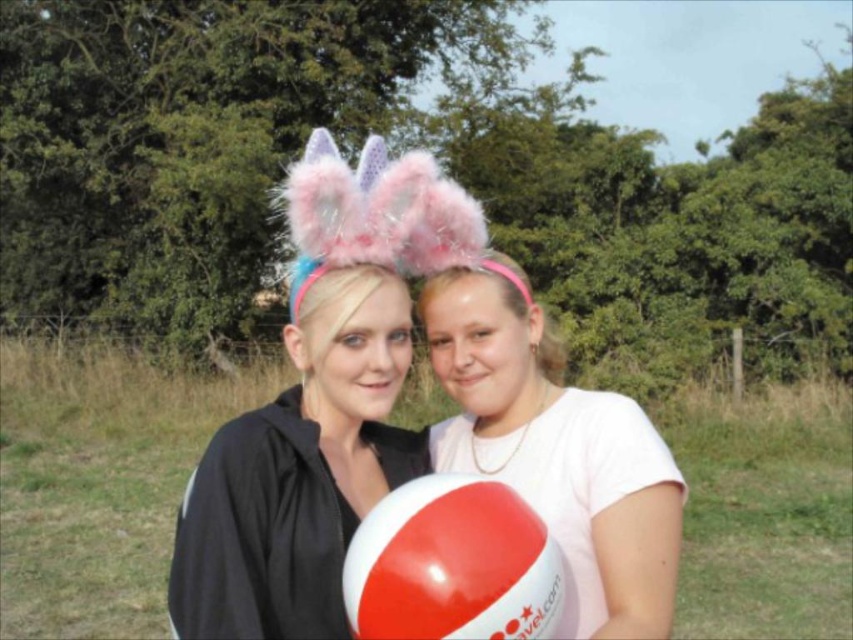
You are a photographer trying to capture both the white matte balloon at center and the white glossy beach ball at center in a single frame. Given that your camera has a minimum focus distance of 12 inches, will you be able to focus on both objects without moving closer?

The distance between the white matte balloon at center and the white glossy beach ball at center is 15.85 inches, which is greater than the camera minimum focus distance of 12 inches. Therefore, the photographer can focus on both objects without moving closer.

Looking at this image, you are standing in the middle of the field and see both the white matte balloon at center and the white glossy beach ball at center. Which object is positioned to the right side?

The white matte balloon at center is positioned to the right of the white glossy beach ball at center.

You are a photographer trying to capture a clear photo of both the white matte balloon at center and the white glossy beach ball at center. Since you want both objects in focus, which one should you adjust your camera focus on first?

You should focus on the white glossy beach ball at center first because it is farther away from the viewer than the white matte balloon at center, ensuring both are in focus when using depth of field techniques.